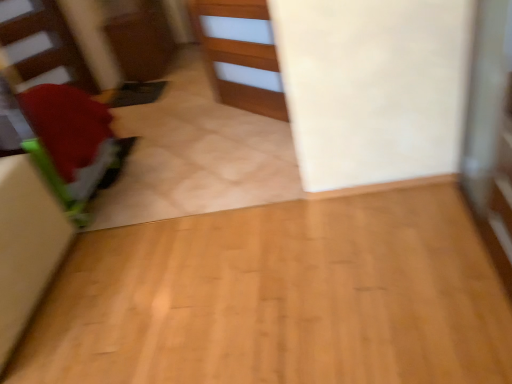
Question: Based on their sizes in the image, would you say wooden cabinet at center is bigger or smaller than matte red stairwell at left?

Choices:
 (A) small
 (B) big

Answer: (B)

Question: From a real-world perspective, is wooden cabinet at center physically located above or below matte red stairwell at left?

Choices:
 (A) below
 (B) above

Answer: (A)

Question: Which object is the closest to the matte red stairwell at left?

Choices:
 (A) wooden cabinet at center
 (B) green fabric cushion at left

Answer: (B)

Question: Considering the real-world distances, which object is closest to the matte red stairwell at left?

Choices:
 (A) green fabric cushion at left
 (B) wooden cabinet at center

Answer: (A)